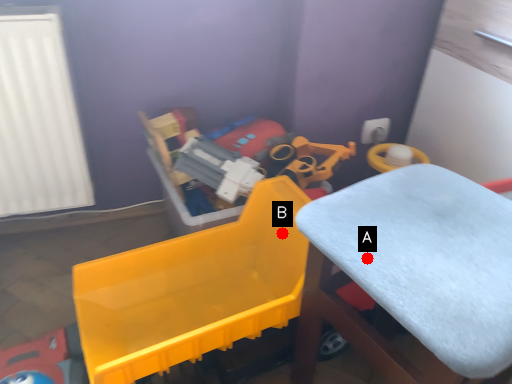
Question: Two points are circled on the image, labeled by A and B beside each circle. Which point is farther to the camera?

Choices:
 (A) A is further
 (B) B is further

Answer: (B)